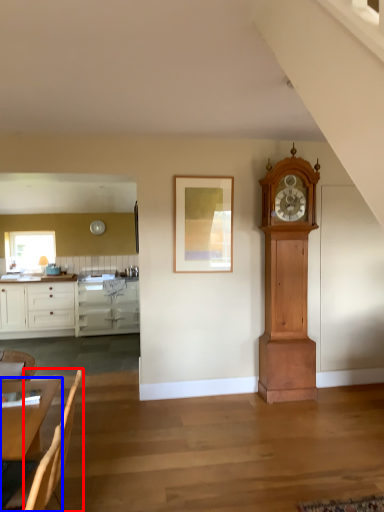
Question: Among these objects, which one is nearest to the camera, armchair (highlighted by a red box) or table (highlighted by a blue box)?

Choices:
 (A) armchair
 (B) table

Answer: (B)